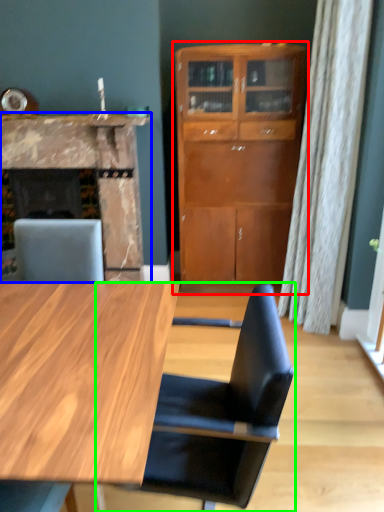
Question: Based on their relative distances, which object is farther from cabinetry (highlighted by a red box)? Choose from fireplace (highlighted by a blue box) and chair (highlighted by a green box).

Choices:
 (A) fireplace
 (B) chair

Answer: (B)